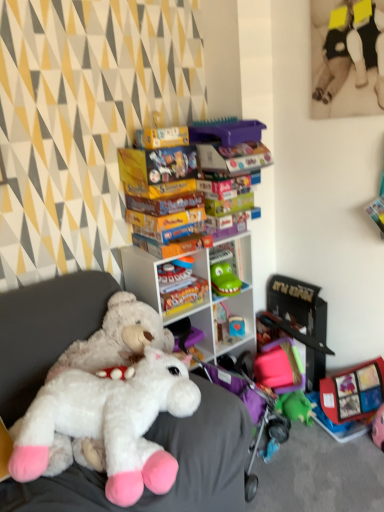
Find the location of a particular element. The width and height of the screenshot is (384, 512). green plastic toy at center is located at coordinates (235, 257).

Describe the element at coordinates (347, 57) in the screenshot. I see `soft plush toy at upper right, acting as the third toy starting from the back` at that location.

Locate an element on the screen. green plastic toy at center is located at coordinates (235, 257).

Does smooth plastic toy at center, which is the first toy from back to front, have a lesser height compared to green plastic toy at center?

Yes, smooth plastic toy at center, which is the first toy from back to front, is shorter than green plastic toy at center.

From a real-world perspective, between smooth plastic toy at center, which is counted as the second toy, starting from the bottom, and green plastic toy at center, who is vertically higher?

green plastic toy at center, from a real-world perspective.

Based on the photo, is smooth plastic toy at center, the 3th toy from the front, positioned far away from green plastic toy at center?

No.

Between smooth plastic toy at center, which is the first toy from back to front, and green plastic toy at center, which one appears on the left side from the viewer's perspective?

Positioned to the left is green plastic toy at center.

Is white plastic shelf at center wider or thinner than soft plush toy at upper right, acting as the third toy starting from the back?

Considering their sizes, white plastic shelf at center looks broader than soft plush toy at upper right, acting as the third toy starting from the back.

Consider the image. How much distance is there between white plastic shelf at center and soft plush toy at upper right, positioned as the first toy in front-to-back order?

white plastic shelf at center and soft plush toy at upper right, positioned as the first toy in front-to-back order, are 37.98 inches apart from each other.

From a real-world perspective, which is physically above, white plastic shelf at center or soft plush toy at upper right, acting as the third toy starting from the back?

In real-world perspective, soft plush toy at upper right, acting as the third toy starting from the back, is above.

Who is more distant, white plastic shelf at center or soft plush toy at upper right, acting as the third toy starting from the back?

Positioned behind is white plastic shelf at center.

Looking at this image, from the image's perspective, between smooth plastic toy at center, the 3th toy from the front, and soft plush toy at upper right, positioned as the first toy in front-to-back order, which one is located above?

From the image's view, soft plush toy at upper right, positioned as the first toy in front-to-back order, is above.

Is smooth plastic toy at center, which ranks as the 2th toy in top-to-bottom order, to the left of soft plush toy at upper right, the 1th toy positioned from the top, from the viewer's perspective?

Yes.

From the picture: From a real-world perspective, between smooth plastic toy at center, which ranks as the 2th toy in top-to-bottom order, and soft plush toy at upper right, acting as the third toy starting from the back, who is vertically higher?

In real-world perspective, soft plush toy at upper right, acting as the third toy starting from the back, is above.

Can you tell me how much smooth plastic toy at center, which is counted as the second toy, starting from the bottom, and soft plush toy at upper right, acting as the third toy starting from the back, differ in facing direction?

The angle between the facing direction of smooth plastic toy at center, which is counted as the second toy, starting from the bottom, and the facing direction of soft plush toy at upper right, acting as the third toy starting from the back, is 62.9 degrees.

From the image's perspective, which is above, smooth plastic toy at center, the 3th toy from the front, or white plush toy at center?

smooth plastic toy at center, the 3th toy from the front, appears higher in the image.

From a real-world perspective, is smooth plastic toy at center, which ranks as the 2th toy in top-to-bottom order, positioned over white plush toy at center based on gravity?

No, from a real-world perspective, smooth plastic toy at center, which ranks as the 2th toy in top-to-bottom order, is not over white plush toy at center

Measure the distance from smooth plastic toy at center, which is counted as the second toy, starting from the bottom, to white plush toy at center.

smooth plastic toy at center, which is counted as the second toy, starting from the bottom, is 3.30 feet from white plush toy at center.

Is smooth plastic toy at center, the 3th toy from the front, aimed at white plush toy at center?

No, smooth plastic toy at center, the 3th toy from the front, does not turn towards white plush toy at center.

Who is shorter, green plastic toy at center or smooth plastic toy at center, which ranks as the 2th toy in top-to-bottom order?

Standing shorter between the two is smooth plastic toy at center, which ranks as the 2th toy in top-to-bottom order.

How many degrees apart are the facing directions of green plastic toy at center and smooth plastic toy at center, the 3th toy from the front?

They differ by 10.8 degrees in their facing directions.

Consider the image. Does green plastic toy at center have a lesser width compared to smooth plastic toy at center, the 3th toy from the front?

No, green plastic toy at center is not thinner than smooth plastic toy at center, the 3th toy from the front.

Does point (240, 239) appear closer or farther from the camera than point (228, 321)?

Point (240, 239) is closer to the camera than point (228, 321).

Is soft plush toy at upper right, positioned as the first toy in front-to-back order, positioned far away from smooth plastic toy at center, which is the first toy from back to front?

Indeed, soft plush toy at upper right, positioned as the first toy in front-to-back order, is not near smooth plastic toy at center, which is the first toy from back to front.

Could you measure the distance between soft plush toy at upper right, the 1th toy positioned from the top, and smooth plastic toy at center, which ranks as the 2th toy in top-to-bottom order?

A distance of 4.58 feet exists between soft plush toy at upper right, the 1th toy positioned from the top, and smooth plastic toy at center, which ranks as the 2th toy in top-to-bottom order.

Consider the image. Considering the sizes of objects soft plush toy at upper right, the 1th toy positioned from the top, and smooth plastic toy at center, the 3th toy from the front, in the image provided, who is bigger, soft plush toy at upper right, the 1th toy positioned from the top, or smooth plastic toy at center, the 3th toy from the front,?

With larger size is soft plush toy at upper right, the 1th toy positioned from the top.

Considering the relative sizes of soft plush toy at upper right, the 1th toy positioned from the top, and smooth plastic toy at center, the 3th toy from the front, in the image provided, is soft plush toy at upper right, the 1th toy positioned from the top, thinner than smooth plastic toy at center, the 3th toy from the front,?

Yes.

Can you confirm if white plastic shelf at center is positioned to the left of green plastic toy at center?

Yes.

Can you confirm if white plastic shelf at center is shorter than green plastic toy at center?

No.

Looking at this image, can you confirm if white plastic shelf at center is bigger than green plastic toy at center?

Yes.

You are a GUI agent. You are given a task and a screenshot of the screen. Output one action in this format:
    pyautogui.click(x=<x>, y=<y>)
    Task: Click on the 1st toy to the right of the green plastic toy at center, counting from the anchor's position
    The height and width of the screenshot is (512, 384).
    Given the screenshot: What is the action you would take?
    pyautogui.click(x=236, y=326)

In order to click on cabinetry beneath the soft plush toy at upper right, positioned as the first toy in front-to-back order (from a real-world perspective) in this screenshot , I will do `click(203, 296)`.

Considering their positions, is smooth plastic toy at center, which is counted as the second toy, starting from the bottom, positioned closer to soft plush toy at upper right, the 1th toy positioned from the top, than white plastic shelf at center?

white plastic shelf at center is positioned closer to the anchor soft plush toy at upper right, the 1th toy positioned from the top.

Based on their spatial positions, is green plastic toy at center or white plastic shelf at center closer to soft plush toy at upper right, which is counted as the 3th toy, starting from the bottom?

green plastic toy at center.

Based on their spatial positions, is black plastic toy at right, which is counted as the second toy, starting from the back, or white plastic shelf at center closer to green plastic toy at center?

white plastic shelf at center lies closer to green plastic toy at center than the other object.

Estimate the real-world distances between objects in this image. Which object is closer to soft plush toy at upper right, which is counted as the 3th toy, starting from the bottom, black plastic toy at right, the second toy viewed from the front, or white plastic shelf at center?

Based on the image, white plastic shelf at center appears to be nearer to soft plush toy at upper right, which is counted as the 3th toy, starting from the bottom.

Which object lies nearer to the anchor point white plush toy at center, black plastic toy at right, the second toy viewed from the front, or soft plush toy at upper right, which is counted as the 3th toy, starting from the bottom?

black plastic toy at right, the second toy viewed from the front, lies closer to white plush toy at center than the other object.

Looking at the image, which one is located further to white plush toy at center, black plastic toy at right, the second toy viewed from the front, or green plastic toy at center?

black plastic toy at right, the second toy viewed from the front.

Based on their spatial positions, is white plastic shelf at center or soft plush toy at upper right, acting as the third toy starting from the back, closer to black plastic toy at right, the second toy viewed from the front?

A: The object closer to black plastic toy at right, the second toy viewed from the front, is white plastic shelf at center.

Considering their positions, is soft plush toy at upper right, acting as the third toy starting from the back, positioned closer to white plush toy at center than green plastic toy at center?

The object closer to white plush toy at center is green plastic toy at center.

The width and height of the screenshot is (384, 512). What are the coordinates of `shelf between soft plush toy at upper right, which is counted as the 3th toy, starting from the bottom, and black plastic toy at right, which is counted as the second toy, starting from the back, from top to bottom` in the screenshot? It's located at (235, 257).

Identify the location of shelf between white plastic shelf at center and smooth plastic toy at center, which ranks as the 2th toy in top-to-bottom order, in the front-back direction. This screenshot has width=384, height=512. (235, 257).

Locate an element on the screen. toy between soft plush toy at upper right, acting as the third toy starting from the back, and black plastic toy at right, positioned as the third toy in top-to-bottom order, in the vertical direction is located at coordinates (236, 326).

Locate an element on the screen. cabinetry between white plush toy at center and black plastic toy at right, the 1th toy in the bottom-to-top sequence, along the z-axis is located at coordinates (203, 296).